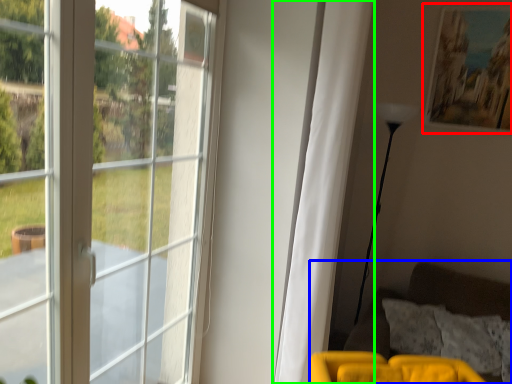
Question: Which is nearer to the picture frame (highlighted by a red box)? couch (highlighted by a blue box) or curtain (highlighted by a green box).

Choices:
 (A) couch
 (B) curtain

Answer: (B)